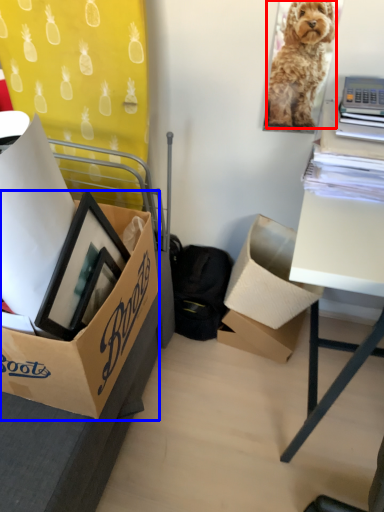
Question: Which point is further to the camera, dog (highlighted by a red box) or box (highlighted by a blue box)?

Choices:
 (A) dog
 (B) box

Answer: (A)